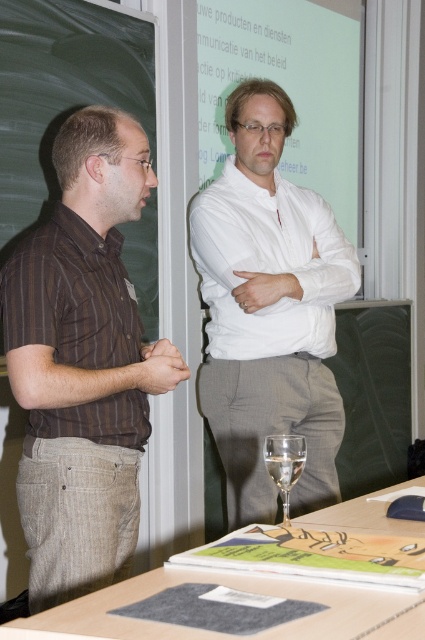
Question: Based on their relative distances, which object is nearer to the wooden table at lower center?

Choices:
 (A) white smooth shirt at center
 (B) clear glass wine glass at lower center
 (C) black chalkboard at left

Answer: (B)

Question: Can you confirm if white smooth shirt at center is positioned to the right of black chalkboard at left?

Choices:
 (A) yes
 (B) no

Answer: (A)

Question: Does brown striped shirt at left appear on the left side of white smooth shirt at center?

Choices:
 (A) no
 (B) yes

Answer: (B)

Question: Which point appears closest to the camera in this image?

Choices:
 (A) (42, 540)
 (B) (232, 426)

Answer: (A)

Question: Is brown striped shirt at left below clear glass wine glass at lower center?

Choices:
 (A) no
 (B) yes

Answer: (A)

Question: Which object is the closest to the brown striped shirt at left?

Choices:
 (A) wooden table at lower center
 (B) clear glass wine glass at lower center

Answer: (B)